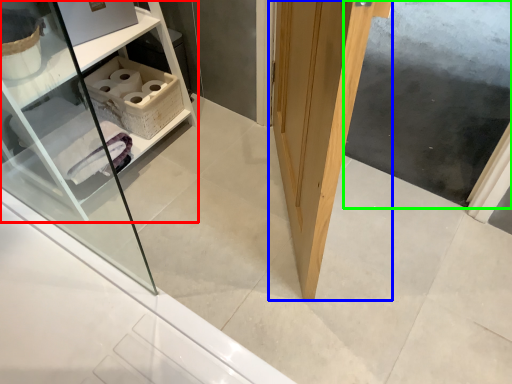
Question: Which object is the farthest from shelf (highlighted by a red box)? Choose among these: door (highlighted by a blue box) or screen door (highlighted by a green box).

Choices:
 (A) door
 (B) screen door

Answer: (B)